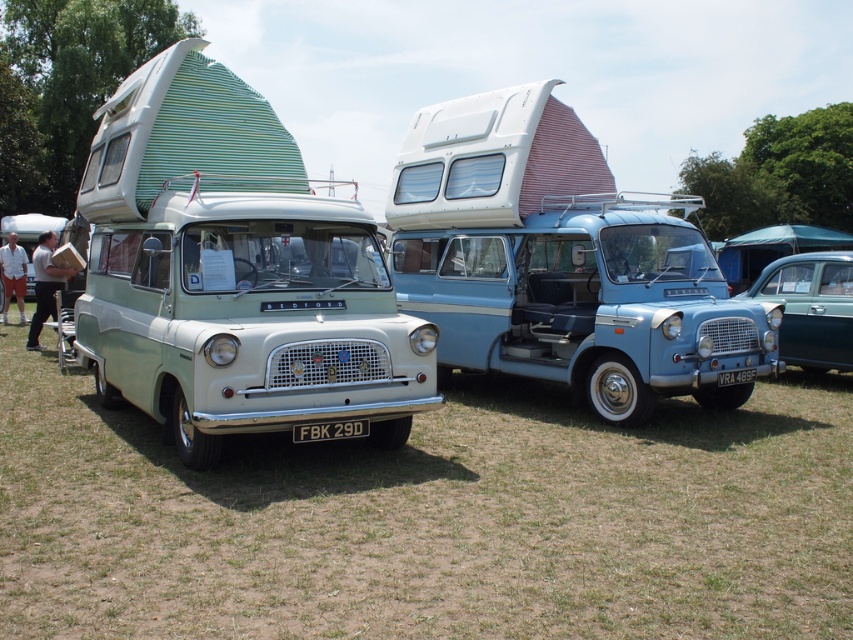
Who is positioned more to the right, light blue metallic van at center or white plastic license plate at center?

light blue metallic van at center

Looking at this image, between light blue metallic van at center and white plastic license plate at center, which one is positioned higher?

light blue metallic van at center

Is point (463, 118) positioned in front of point (320, 426)?

No.

Where is `light blue metallic van at center`? light blue metallic van at center is located at coordinates (563, 262).

Is light blue metallic van at center closer to camera compared to teal metallic car at center?

Yes, light blue metallic van at center is closer to the viewer.

Does light blue metallic van at center have a smaller size compared to teal metallic car at center?

Indeed, light blue metallic van at center has a smaller size compared to teal metallic car at center.

Does point (595, 205) come behind point (811, 330)?

No, it is not.

Locate an element on the screen. light blue metallic van at center is located at coordinates (563, 262).

Between matte green van at center and teal metallic car at center, which one is positioned higher?

Positioned higher is matte green van at center.

I want to click on matte green van at center, so click(250, 316).

In order to click on matte green van at center in this screenshot , I will do pyautogui.click(x=250, y=316).